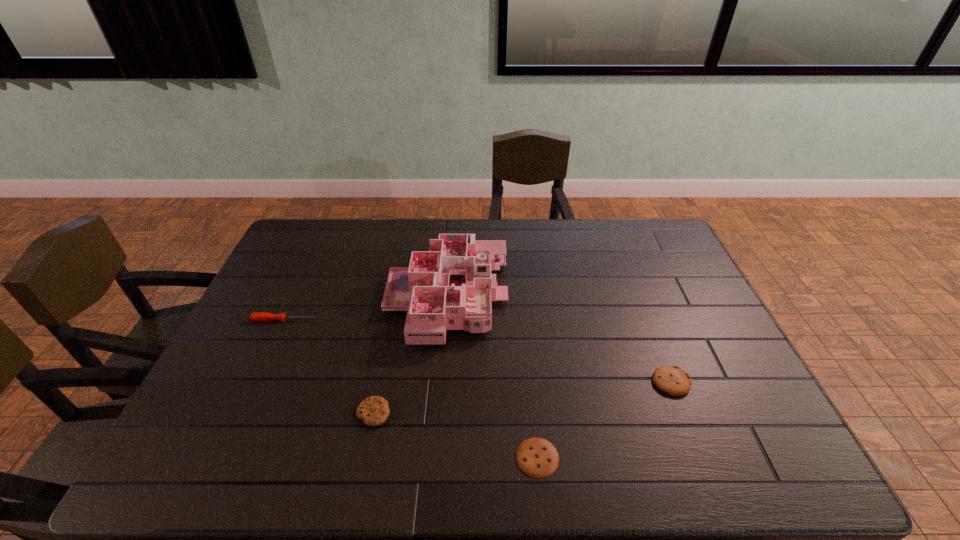
What are the coordinates of `dollhouse` in the screenshot? It's located at (450, 287).

At what (x,y) coordinates should I click in order to perform the action: click on the third farthest object. Please return your answer as a coordinate pair (x, y). Looking at the image, I should click on (674, 381).

Identify the location of the rightmost cookie. This screenshot has width=960, height=540. (x=674, y=381).

Find the location of a particular element. Image resolution: width=960 pixels, height=540 pixels. screwdriver is located at coordinates click(x=262, y=316).

Find the location of a particular element. This screenshot has width=960, height=540. the second farthest cookie is located at coordinates (374, 411).

Where is `the leftmost cookie`? This screenshot has height=540, width=960. the leftmost cookie is located at coordinates pos(374,411).

This screenshot has width=960, height=540. What are the coordinates of `the nearest object` in the screenshot? It's located at (538, 458).

The width and height of the screenshot is (960, 540). Identify the location of the shortest object. (538, 458).

At what (x,y) coordinates should I click in order to perform the action: click on vacant space situated 0.210m at the front entrance of the tallest object. Please return your answer as a coordinate pair (x, y). Image resolution: width=960 pixels, height=540 pixels. Looking at the image, I should click on (574, 298).

Locate an element on the screen. The width and height of the screenshot is (960, 540). vacant space located on the back of the farthest cookie is located at coordinates (629, 274).